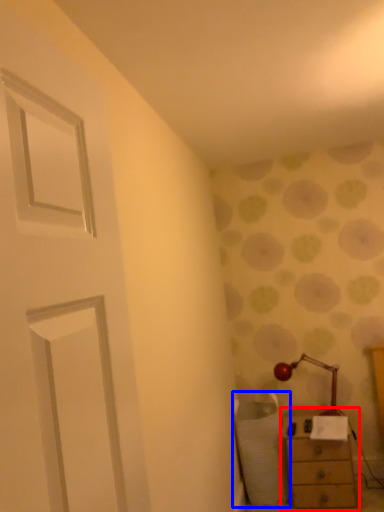
Question: Which of the following is the farthest to the observer, chest of drawers (highlighted by a red box) or swivel chair (highlighted by a blue box)?

Choices:
 (A) chest of drawers
 (B) swivel chair

Answer: (B)